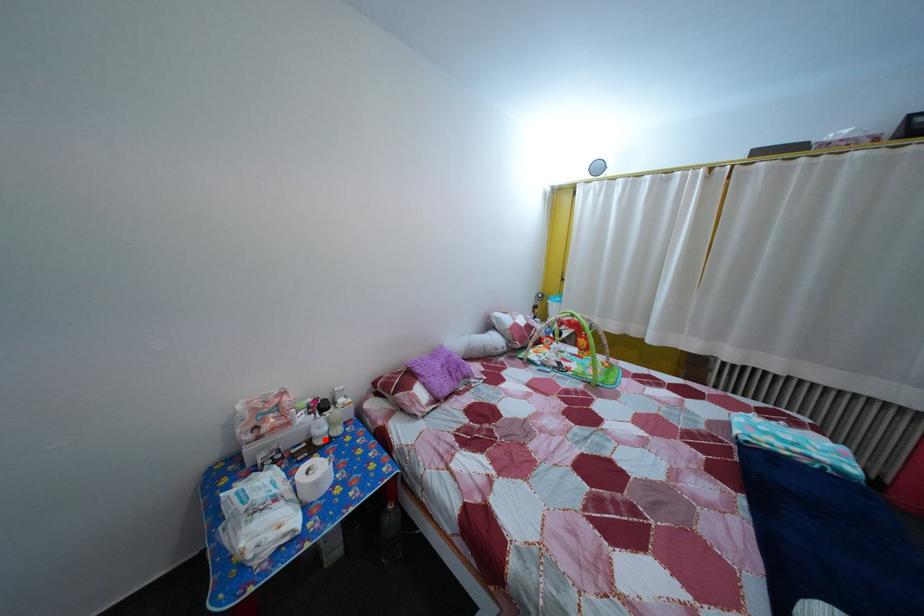
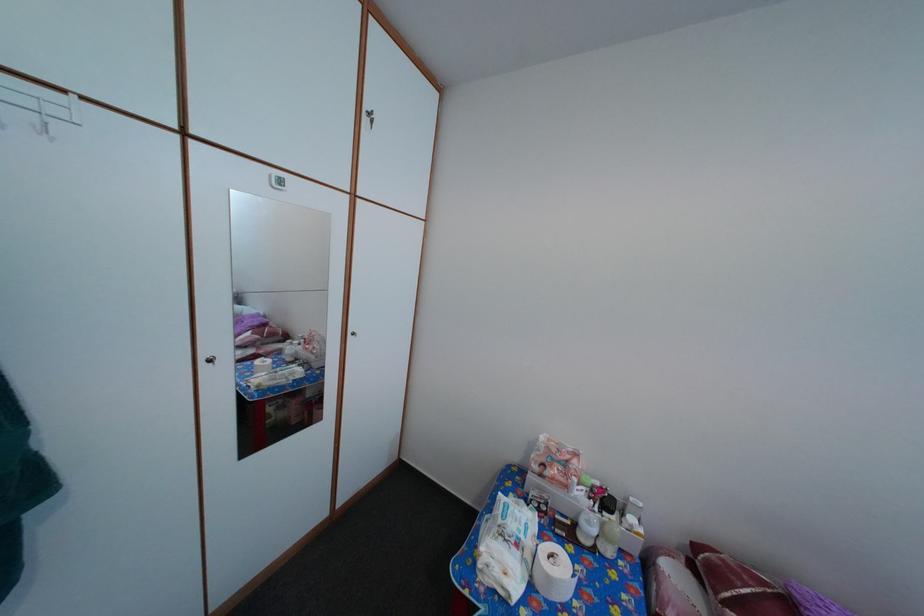
Question: I am providing you with two images of the same scene from different viewpoints. A red point is shown in image1. For the corresponding object point in image2, is it positioned nearer or farther from the camera?

Choices:
 (A) Nearer
 (B) Farther

Answer: (B)